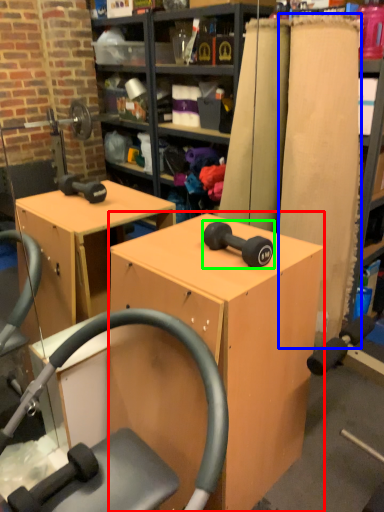
Question: Estimate the real-world distances between objects in this image. Which object is closer to furniture (highlighted by a red box), plank (highlighted by a blue box) or dumbbell (highlighted by a green box)?

Choices:
 (A) plank
 (B) dumbbell

Answer: (B)